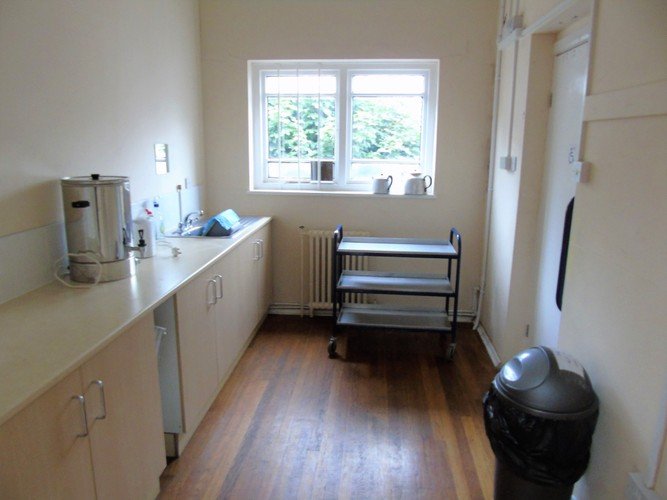
Image resolution: width=667 pixels, height=500 pixels. Find the location of `cabinet handle`. cabinet handle is located at coordinates coord(99,387), coord(83,406), coord(215,296), coord(219,283), coord(257,252), coord(261,244).